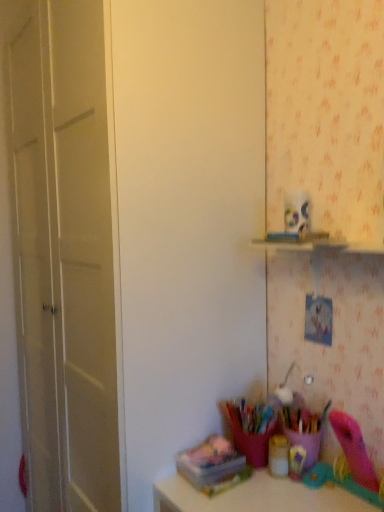
Question: Is the position of translucent plastic container at lower center, the 3th stationery from the right, less distant than that of matte gold container at lower center, marked as the second stationery in a left-to-right arrangement?

Choices:
 (A) no
 (B) yes

Answer: (B)

Question: Is there a large distance between translucent plastic container at lower center, the 3th stationery from the right, and matte gold container at lower center, marked as the second stationery in a left-to-right arrangement?

Choices:
 (A) no
 (B) yes

Answer: (A)

Question: From the image's perspective, is translucent plastic container at lower center, marked as the first stationery in a left-to-right arrangement, beneath matte gold container at lower center, the 2th stationery in the right-to-left sequence?

Choices:
 (A) yes
 (B) no

Answer: (A)

Question: Can you confirm if translucent plastic container at lower center, marked as the first stationery in a left-to-right arrangement, is thinner than matte gold container at lower center, the 2th stationery in the right-to-left sequence?

Choices:
 (A) no
 (B) yes

Answer: (A)

Question: Is translucent plastic container at lower center, marked as the first stationery in a left-to-right arrangement, in contact with matte gold container at lower center, the 2th stationery in the right-to-left sequence?

Choices:
 (A) yes
 (B) no

Answer: (B)

Question: From the image's perspective, is translucent plastic container at lower center, marked as the first stationery in a left-to-right arrangement, over matte gold container at lower center, the 2th stationery in the right-to-left sequence?

Choices:
 (A) yes
 (B) no

Answer: (B)

Question: Is matte white door at left touching translucent plastic container at lower right, the third stationery from the left?

Choices:
 (A) yes
 (B) no

Answer: (B)

Question: Is matte white door at left taller than translucent plastic container at lower right, which is the first stationery in right-to-left order?

Choices:
 (A) no
 (B) yes

Answer: (B)

Question: Does matte white door at left have a greater width compared to translucent plastic container at lower right, the third stationery from the left?

Choices:
 (A) no
 (B) yes

Answer: (B)

Question: Is matte white door at left positioned with its back to translucent plastic container at lower right, which is the first stationery in right-to-left order?

Choices:
 (A) no
 (B) yes

Answer: (A)

Question: From the image's perspective, is matte white door at left on top of translucent plastic container at lower right, which is the first stationery in right-to-left order?

Choices:
 (A) yes
 (B) no

Answer: (A)

Question: Would you say matte white door at left contains translucent plastic container at lower right, the third stationery from the left?

Choices:
 (A) yes
 (B) no

Answer: (B)

Question: Does matte gold container at lower center, marked as the second stationery in a left-to-right arrangement, have a larger size compared to matte white door at left?

Choices:
 (A) yes
 (B) no

Answer: (B)